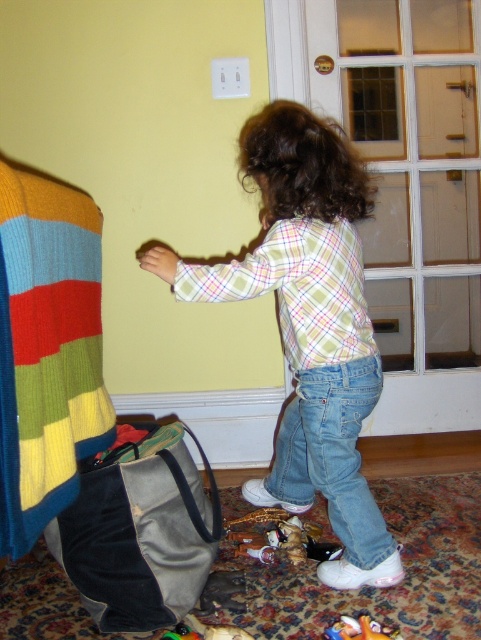
You are a delivery person who needs to place a gray fabric bag at lower left near the point marked at coordinates (139, 531). The room has a white baseboard along the bottom wall and a light switch plate above it. Can you confirm if the gray fabric bag at lower left will be placed on the floor or on the wall?

The point marked at coordinates (139, 531) indicates the gray fabric bag at lower left is placed on the floor since it is located near the baseboard, which is part of the wall structure at the floor level.

The child is wearing a plaid shirt at center and there is a plush fabric stuffed animal at lower center. Which item is closer to the viewer?

The plaid shirt at center is closer to the viewer because it is in front of the plush fabric stuffed animal at lower center.

The child is reaching towards something on the floor. Which object is on top of the other between the gray fabric bag at lower left and the rubberized green toy at lower center?

The gray fabric bag at lower left is positioned over the rubberized green toy at lower center, so the gray fabric bag is on top.